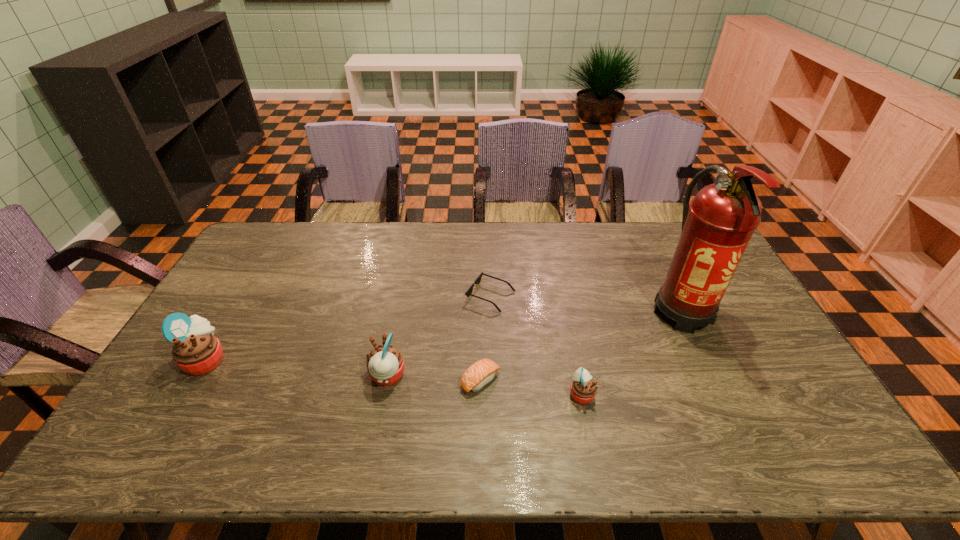
Find the location of a particular element. Image resolution: width=960 pixels, height=540 pixels. object that is at the left edge is located at coordinates (196, 351).

Image resolution: width=960 pixels, height=540 pixels. In order to click on object at the right edge in this screenshot , I will do `click(715, 232)`.

The width and height of the screenshot is (960, 540). What are the coordinates of `free spot at the far edge of the desktop` in the screenshot? It's located at (532, 249).

The width and height of the screenshot is (960, 540). In order to click on vacant space at the near edge of the desktop in this screenshot , I will do `click(301, 393)`.

The image size is (960, 540). I want to click on vacant region at the right edge of the desktop, so click(727, 318).

Identify the location of free region at the far left corner of the desktop. This screenshot has height=540, width=960. (284, 249).

What are the coordinates of `vacant space at the near left corner` in the screenshot? It's located at (196, 396).

You are a GUI agent. You are given a task and a screenshot of the screen. Output one action in this format:
    pyautogui.click(x=<x>, y=<y>)
    Task: Click on the vacant space at the far right corner of the desktop
    The height and width of the screenshot is (540, 960).
    Given the screenshot: What is the action you would take?
    pyautogui.click(x=675, y=245)

The height and width of the screenshot is (540, 960). I want to click on vacant space that is in between the tallest object and the shortest object, so click(587, 303).

Find the location of `empty location between the sunglasses and the fourth shortest object`. empty location between the sunglasses and the fourth shortest object is located at coordinates (439, 336).